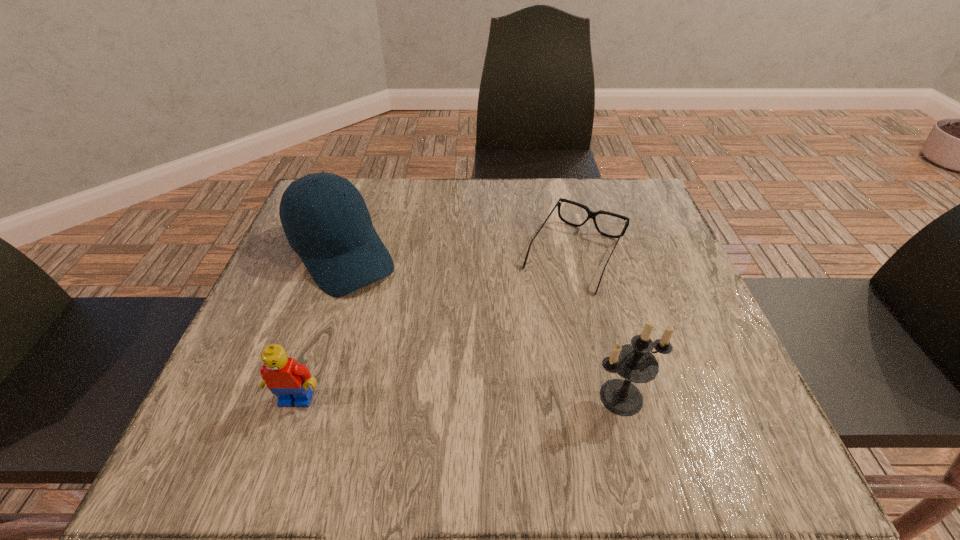
You are a GUI agent. You are given a task and a screenshot of the screen. Output one action in this format:
    pyautogui.click(x=<x>, y=<y>)
    Task: Click on the object present at the near left corner
    The height and width of the screenshot is (540, 960).
    Given the screenshot: What is the action you would take?
    pyautogui.click(x=288, y=380)

Where is `object positioned at the far right corner`? object positioned at the far right corner is located at coordinates (591, 214).

Locate an element on the screen. object that is at the near right corner is located at coordinates (635, 362).

This screenshot has width=960, height=540. In order to click on free point at the far edge in this screenshot , I will do `click(405, 203)`.

I want to click on vacant space at the near edge of the desktop, so click(x=408, y=377).

Where is `vacant space at the right edge of the desktop`? This screenshot has width=960, height=540. vacant space at the right edge of the desktop is located at coordinates (608, 248).

In the image, there is a desktop. Identify the location of vacant space at the near left corner. (268, 400).

Locate an element on the screen. Image resolution: width=960 pixels, height=540 pixels. free space at the far right corner is located at coordinates (607, 230).

Image resolution: width=960 pixels, height=540 pixels. I want to click on vacant space at the near right corner of the desktop, so click(x=678, y=379).

Locate an element on the screen. The height and width of the screenshot is (540, 960). vacant space that is in between the candle holder and the spectacles is located at coordinates (598, 326).